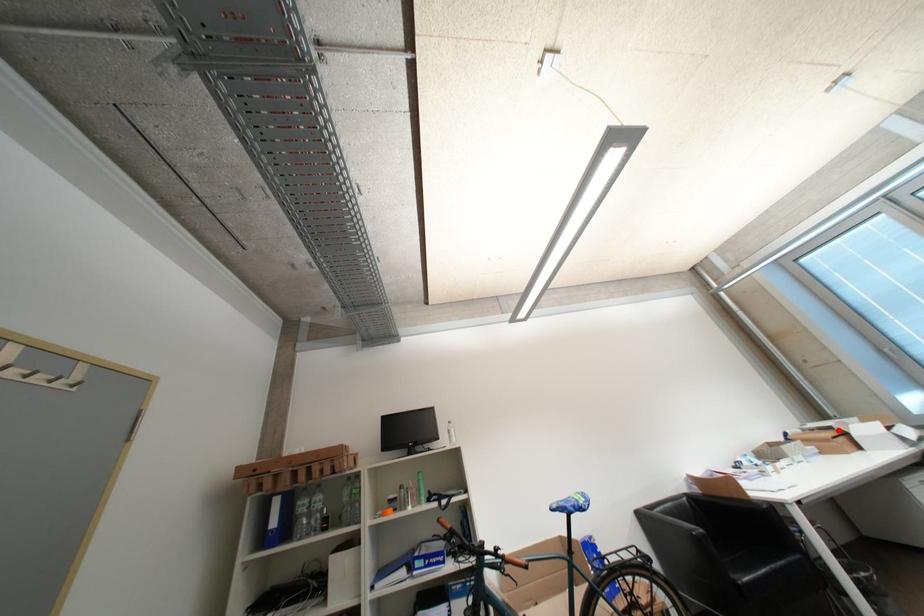
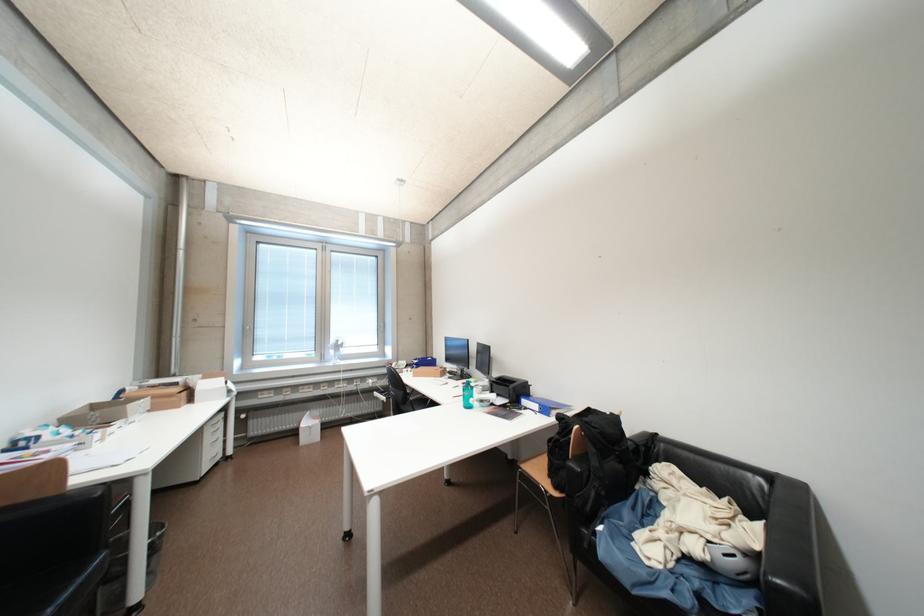
Question: A red point is marked in image1. In image2, is the corresponding 3D point closer to the camera or farther? Reply with the corresponding letter.

Choices:
 (A) The corresponding 3D point is closer.
 (B) The corresponding 3D point is farther.

Answer: (B)